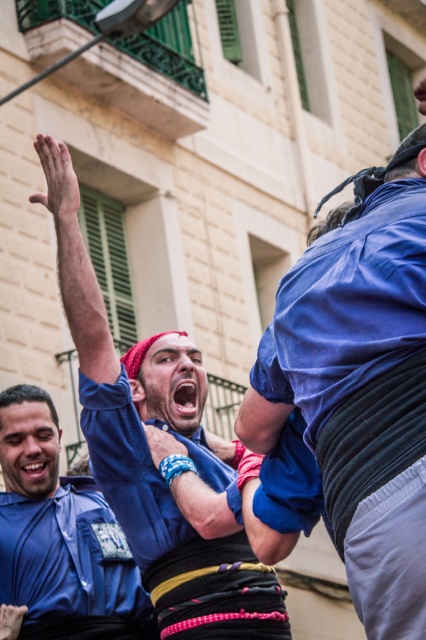
Question: Which point is farther from the camera taking this photo?

Choices:
 (A) (357, 284)
 (B) (75, 212)

Answer: (B)

Question: Observing the image, what is the correct spatial positioning of blue cotton shirt at upper left in reference to blue cotton shirt at lower left?

Choices:
 (A) above
 (B) below

Answer: (A)

Question: Does blue fabric shirt at upper right have a larger size compared to blue cotton shirt at lower left?

Choices:
 (A) no
 (B) yes

Answer: (B)

Question: Which point appears farthest from the camera in this image?

Choices:
 (A) (63, 588)
 (B) (399, 307)

Answer: (A)

Question: In this image, where is blue fabric shirt at upper right located relative to blue cotton shirt at upper left?

Choices:
 (A) right
 (B) left

Answer: (A)

Question: Which object appears closest to the camera in this image?

Choices:
 (A) blue fabric shirt at upper right
 (B) blue cotton shirt at upper left

Answer: (A)